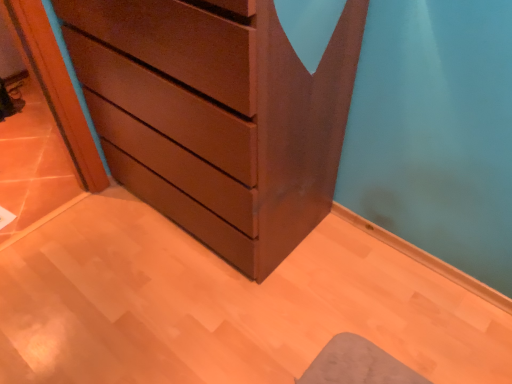
Find the location of a particular element. The height and width of the screenshot is (384, 512). free space to the left of matte brown chest of drawers at center is located at coordinates (84, 241).